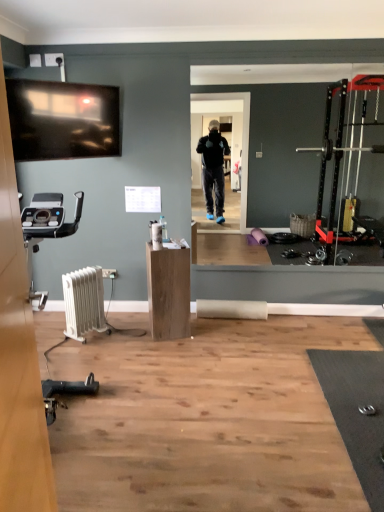
Locate an element on the screen. This screenshot has height=512, width=384. vacant space in front of white plastic radiator at lower left is located at coordinates (94, 350).